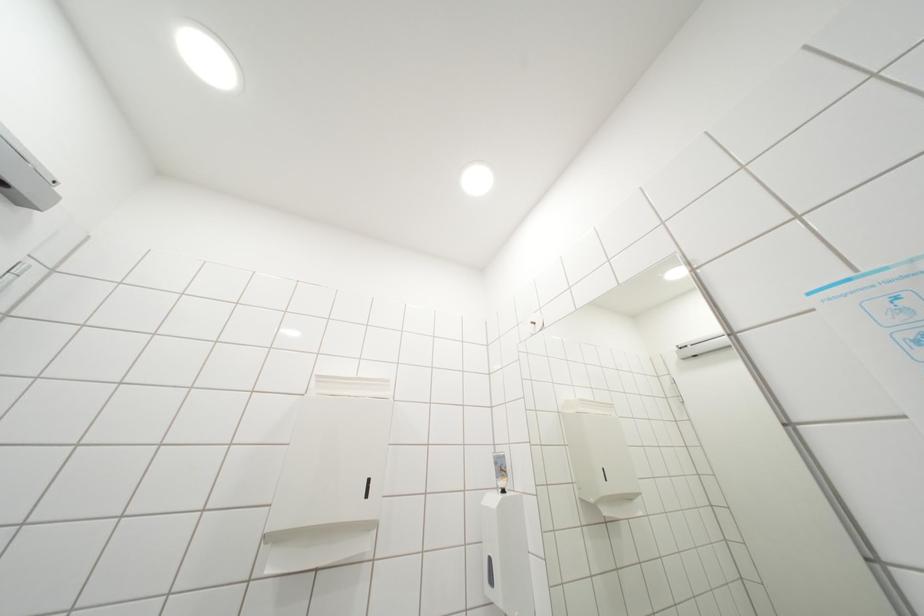
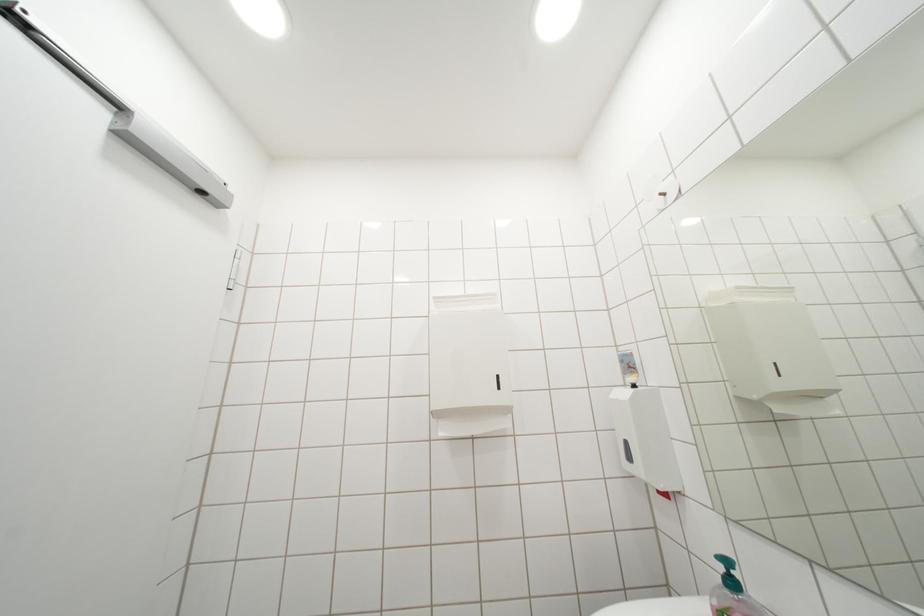
Question: Based on the continuous images, in which direction is the camera rotating? Reply with the corresponding letter.

Choices:
 (A) Left
 (B) Right
 (C) Up
 (D) Down

Answer: (A)